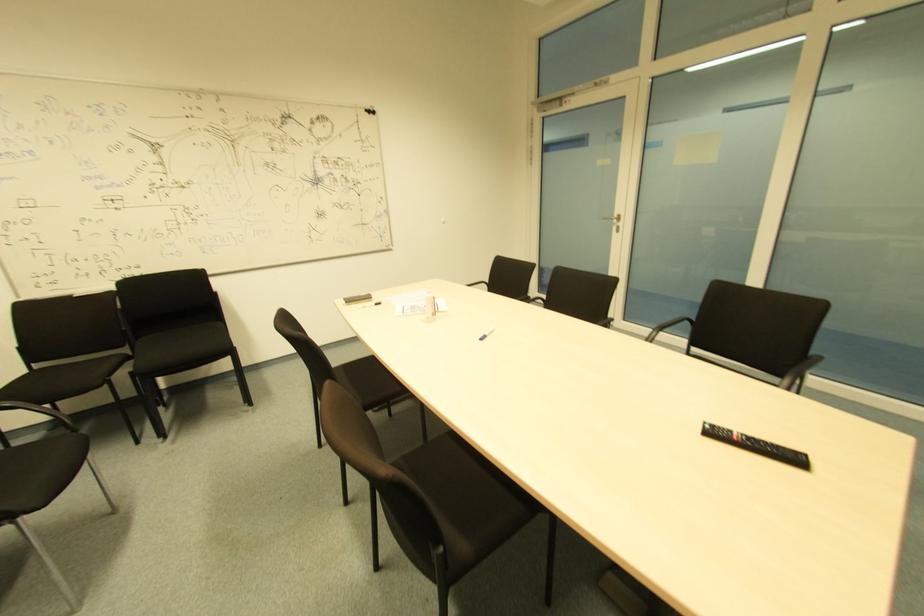
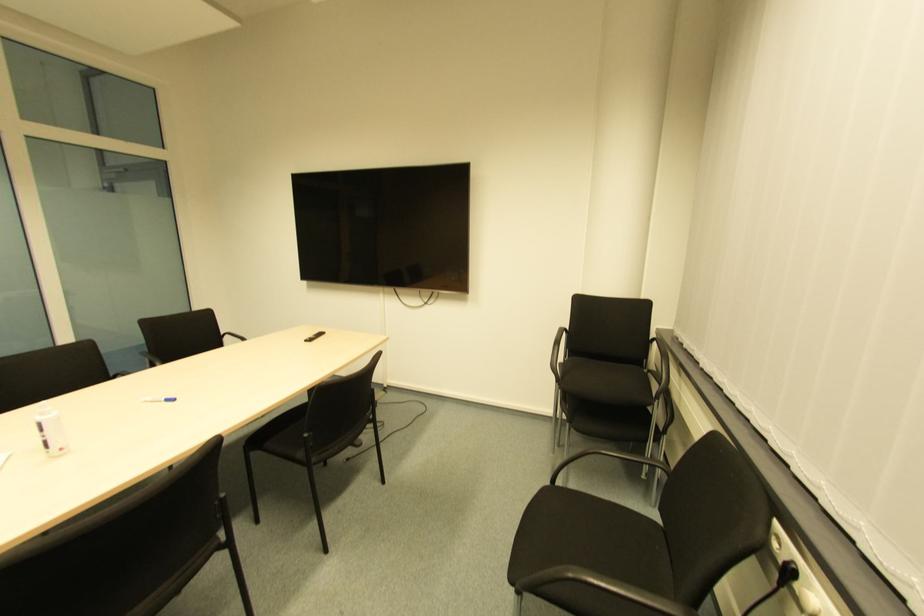
Where in the second image is the point corresponding to (480,342) from the first image?

(172, 403)